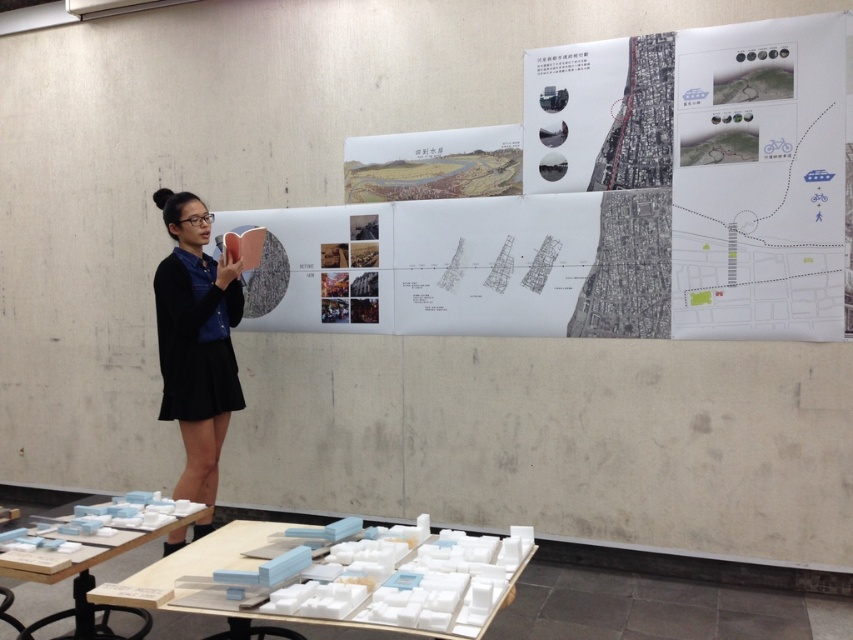
You are attending a presentation about urban planning. The presenter is pointing at two points on the large wall display. The first point is at coordinates point (421,614) and the second is at point (91,628). From your perspective in the room, which point is closer to you?

Point (421,614) is closer to the camera than point (91,628), so from your perspective in the room, the first point you mentioned is closer to you.

You are organizing a model city exhibit and need to place the white foam blocks at lower center and white plastic table at lower left on a display table. The display table has a maximum length of 20 inches. Can both items be placed side by side without exceeding the table length?

The white foam blocks at lower center is 20.48 inches from white plastic table at lower left. Since the distance between them is 20.48 inches, which exceeds the display table length of 20 inches, they cannot be placed side by side without exceeding the table length.

You are organizing a presentation and need to place a decorative centerpiece on the table. Considering the sizes of the white paper map at center and the white plastic table at lower left, will the map fit on the table without folding?

The white paper map at center has a larger size compared to white plastic table at lower left, so the map will not fit on the table without folding.